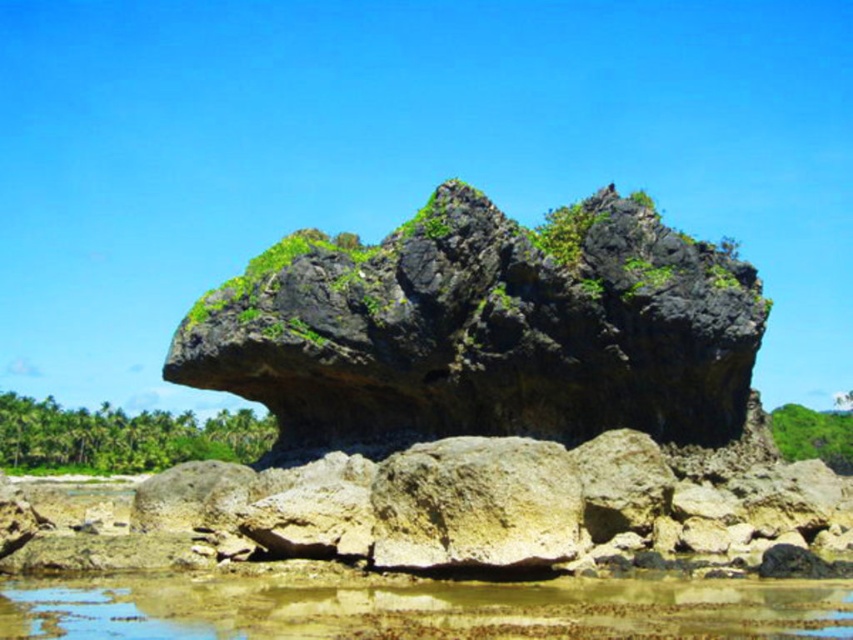
Question: Which point is closer to the camera?

Choices:
 (A) green mossy rock at center
 (B) clear water at lower center

Answer: (B)

Question: Can you confirm if green mossy rock at center is smaller than clear water at lower center?

Choices:
 (A) yes
 (B) no

Answer: (B)

Question: In this image, where is green mossy rock at center located relative to clear water at lower center?

Choices:
 (A) below
 (B) above

Answer: (B)

Question: Does green mossy rock at center lie behind clear water at lower center?

Choices:
 (A) no
 (B) yes

Answer: (B)

Question: Which point is closer to the camera?

Choices:
 (A) green mossy rock at center
 (B) clear water at lower center

Answer: (B)